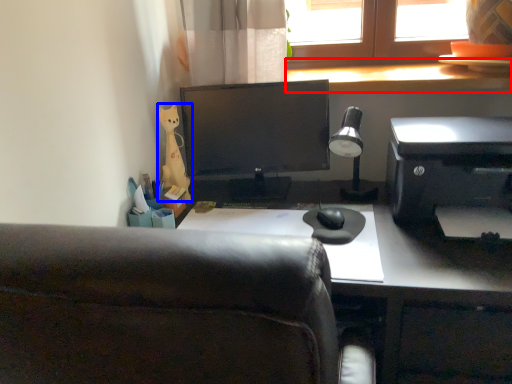
Question: Which of the following is the closest to the observer, window sill (highlighted by a red box) or stationery (highlighted by a blue box)?

Choices:
 (A) window sill
 (B) stationery

Answer: (B)